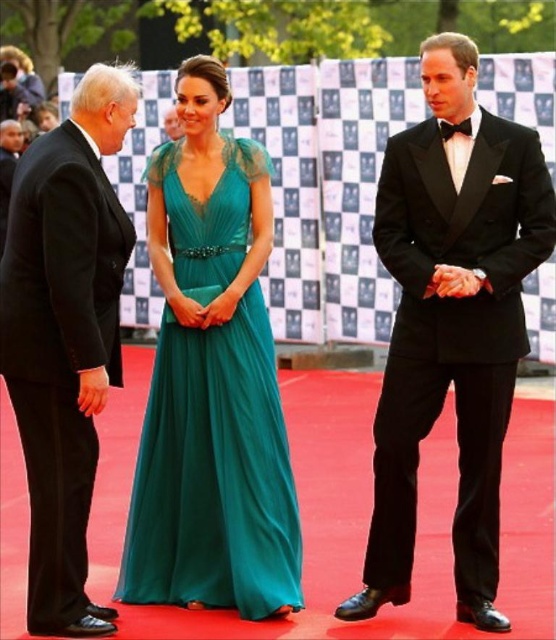
Question: Which point appears farthest from the camera in this image?

Choices:
 (A) (484, 248)
 (B) (37, 589)

Answer: (A)

Question: Does emerald green chiffon dress at center appear under black satin suit at left?

Choices:
 (A) no
 (B) yes

Answer: (B)

Question: Which of the following is the farthest from the observer?

Choices:
 (A) (13, 289)
 (B) (549, 180)
 (C) (267, 394)

Answer: (C)

Question: Which object appears closest to the camera in this image?

Choices:
 (A) black satin tuxedo at center
 (B) emerald green chiffon dress at center
 (C) black satin suit at left

Answer: (C)

Question: Is the position of emerald green chiffon dress at center more distant than that of black satin suit at left?

Choices:
 (A) yes
 (B) no

Answer: (A)

Question: Is black satin tuxedo at center thinner than black satin suit at left?

Choices:
 (A) yes
 (B) no

Answer: (B)